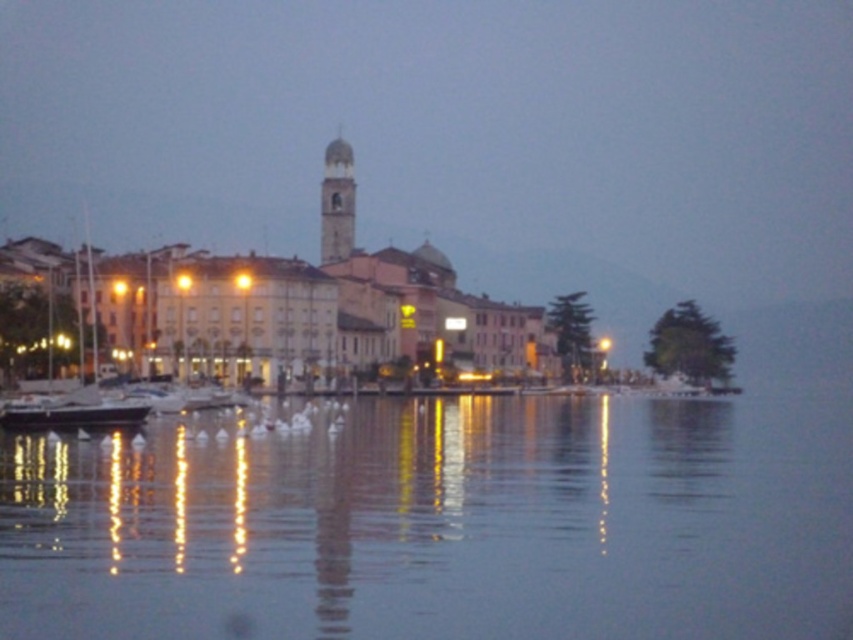
You are an observer standing on the lakeside dock. You see the transparent water at center and the white matte sailboat at left. Which object is positioned lower in the scene?

The transparent water at center is located below the white matte sailboat at left, so it is positioned lower in the scene.